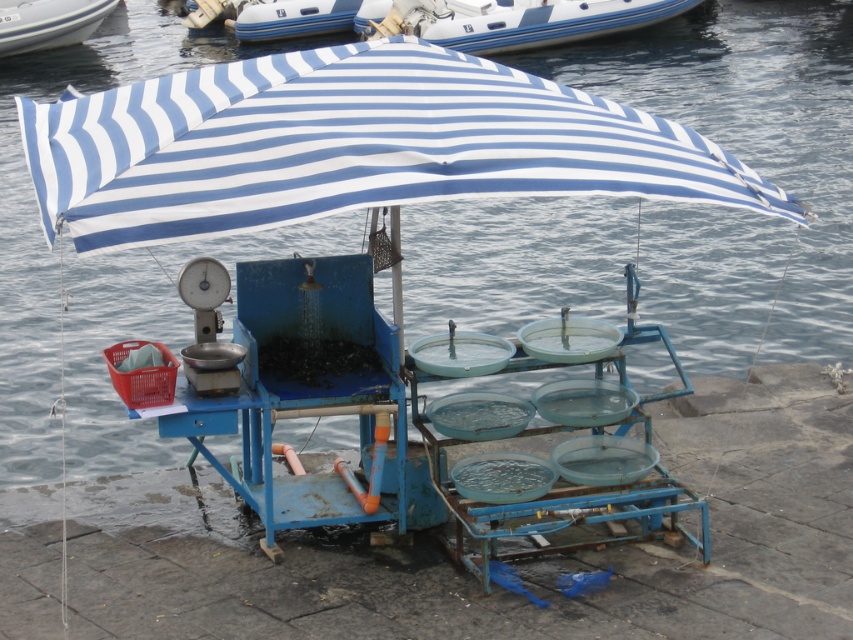
Is blue rubber boat at upper center taller than white glossy boat at upper left?

In fact, blue rubber boat at upper center may be shorter than white glossy boat at upper left.

Does blue rubber boat at upper center come in front of white glossy boat at upper left?

Yes, blue rubber boat at upper center is in front of white glossy boat at upper left.

This screenshot has width=853, height=640. In order to click on blue rubber boat at upper center in this screenshot , I will do `click(509, 20)`.